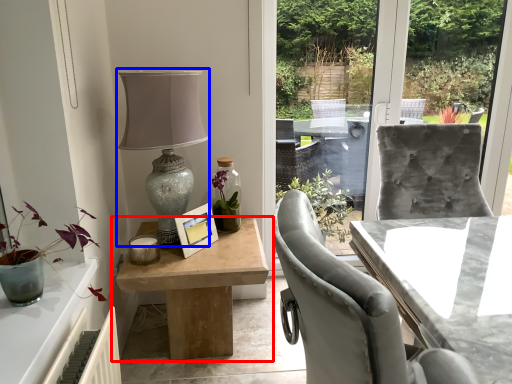
Question: Which object is further to the camera taking this photo, table (highlighted by a red box) or table lamp (highlighted by a blue box)?

Choices:
 (A) table
 (B) table lamp

Answer: (A)